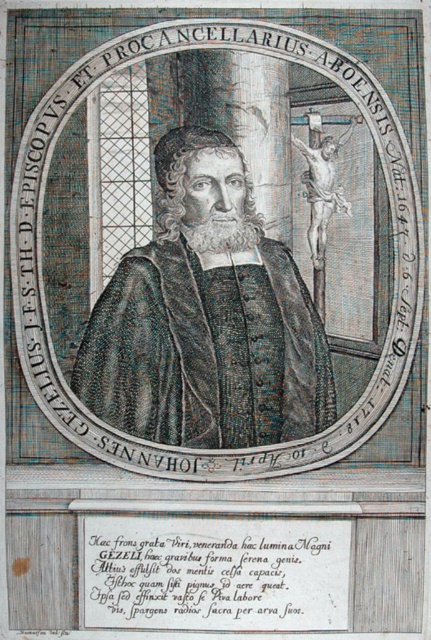
Between point (139, 362) and point (103, 588), which one is positioned behind?

The point (103, 588) is behind.

Who is more forward, (202, 198) or (128, 602)?

Point (202, 198) is more forward.

Which is behind, point (218, 445) or point (343, 616)?

Point (343, 616)

Locate an element on the screen. The width and height of the screenshot is (431, 640). black textured robe at center is located at coordinates (206, 317).